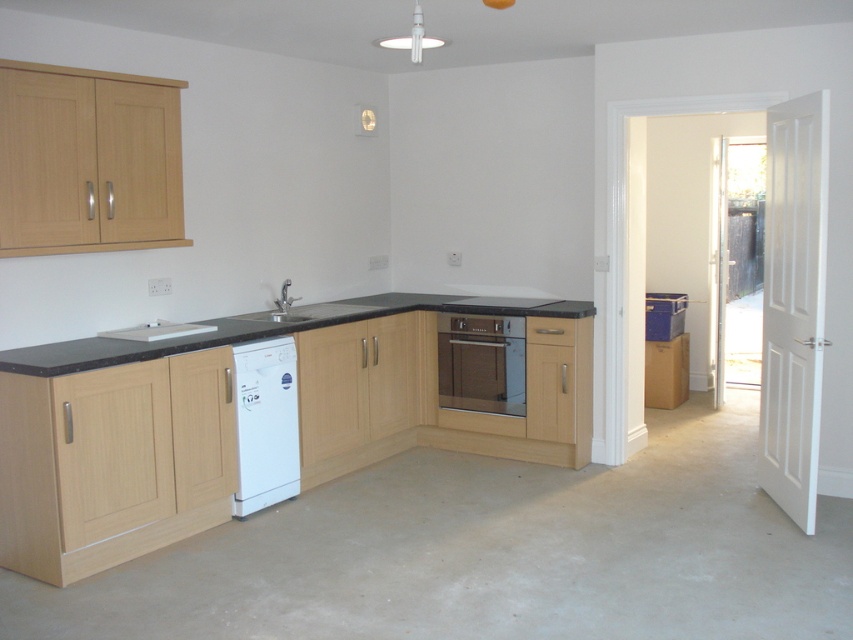
You are a delivery person who needs to place a new microwave that is 1.5 meters wide into the kitchen. The microwave must be placed against the wall where the matte brown oven at center is currently located. Can the microwave fit in the space available? Please explain your reasoning.

The distance between the matte brown oven at center and the camera is 5.12 meters. This measurement indicates the depth of the space where the oven is placed. Since the microwave is only 1.5 meters wide, which is significantly narrower than the available depth, the microwave should fit comfortably in the space provided.

You are a kitchen designer planning to install a new appliance. You have a microwave that needs to be placed at coordinates point 0.5, 0.3. Is the black granite countertop at center located near that position?

The black granite countertop at center is located at point [271,328], which is very close to the desired coordinates of [254,320]. Therefore, the countertop is near the specified position.

You are a kitchen designer planning to install a new microwave above the white glossy dishwasher at lower left. According to the current setup, where should the microwave be placed relative to the matte brown oven at center?

The white glossy dishwasher at lower left is positioned under the matte brown oven at center, so the microwave should be placed above the white glossy dishwasher at lower left, which is directly below the matte brown oven at center.